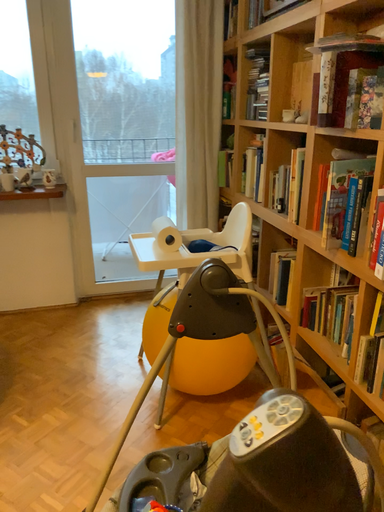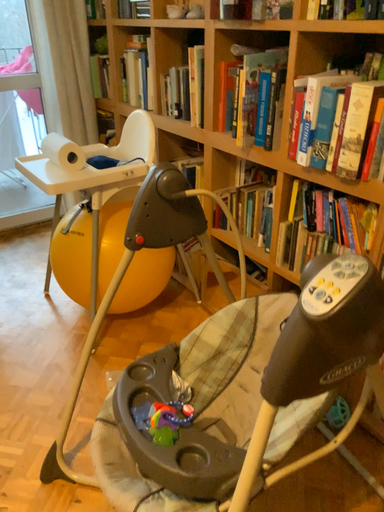
Question: How did the camera likely rotate when shooting the video?

Choices:
 (A) rotated upward
 (B) rotated downward

Answer: (B)